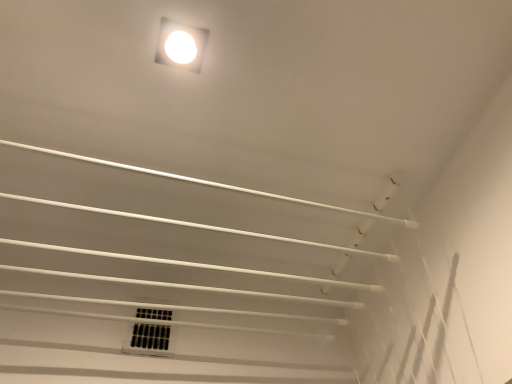
Question: Does white glossy light fixture at upper center come behind white plastic vent at center?

Choices:
 (A) yes
 (B) no

Answer: (B)

Question: Can you confirm if white glossy light fixture at upper center is bigger than white plastic vent at center?

Choices:
 (A) no
 (B) yes

Answer: (A)

Question: Can you confirm if white glossy light fixture at upper center is thinner than white plastic vent at center?

Choices:
 (A) yes
 (B) no

Answer: (B)

Question: Is white plastic vent at center inside white glossy light fixture at upper center?

Choices:
 (A) yes
 (B) no

Answer: (B)

Question: Is white glossy light fixture at upper center outside white plastic vent at center?

Choices:
 (A) no
 (B) yes

Answer: (B)

Question: From a real-world perspective, is white glossy light fixture at upper center physically above white plastic vent at center?

Choices:
 (A) yes
 (B) no

Answer: (A)

Question: Is white plastic vent at center wider than white glossy light fixture at upper center?

Choices:
 (A) no
 (B) yes

Answer: (A)

Question: Is white plastic vent at center positioned in front of white glossy light fixture at upper center?

Choices:
 (A) no
 (B) yes

Answer: (A)

Question: Considering the relative sizes of white plastic vent at center and white glossy light fixture at upper center in the image provided, is white plastic vent at center shorter than white glossy light fixture at upper center?

Choices:
 (A) no
 (B) yes

Answer: (A)

Question: Is the surface of white plastic vent at center in direct contact with white glossy light fixture at upper center?

Choices:
 (A) no
 (B) yes

Answer: (A)

Question: Is white plastic vent at center aimed at white glossy light fixture at upper center?

Choices:
 (A) no
 (B) yes

Answer: (B)

Question: From the image's perspective, does white plastic vent at center appear higher than white glossy light fixture at upper center?

Choices:
 (A) no
 (B) yes

Answer: (A)

Question: In the image, is white glossy light fixture at upper center positioned in front of or behind white plastic vent at center?

Choices:
 (A) front
 (B) behind

Answer: (A)